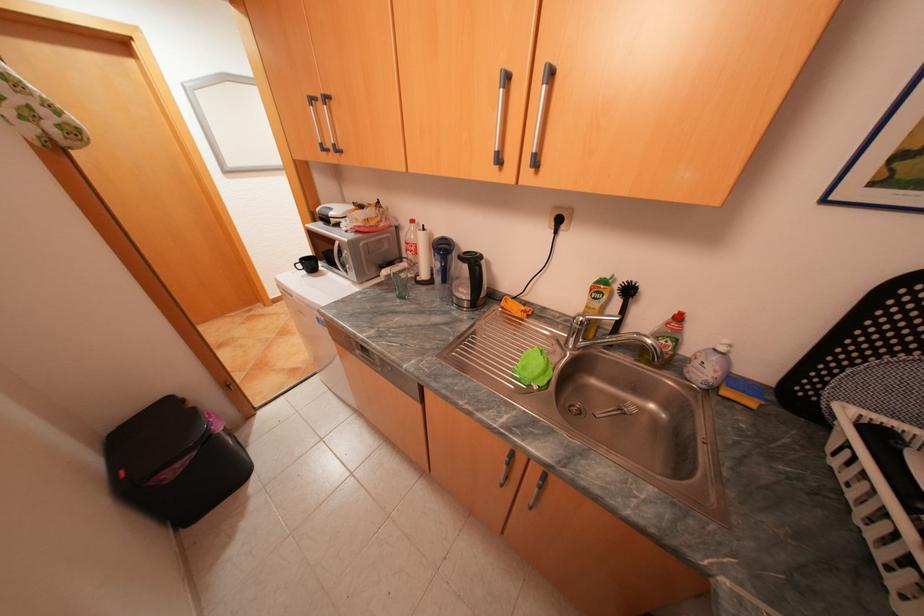
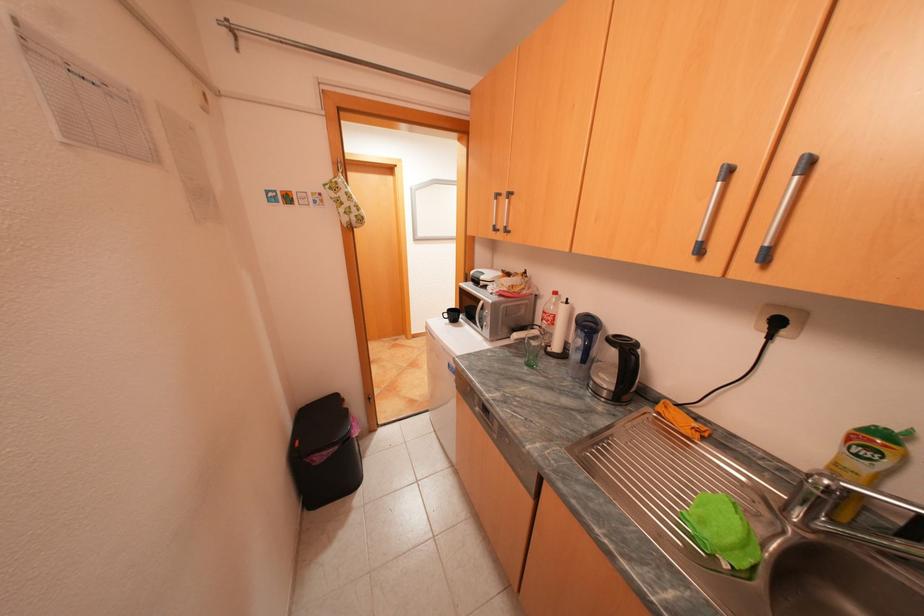
Where in the second image is the point corresponding to [416,243] from the first image?

(553, 312)